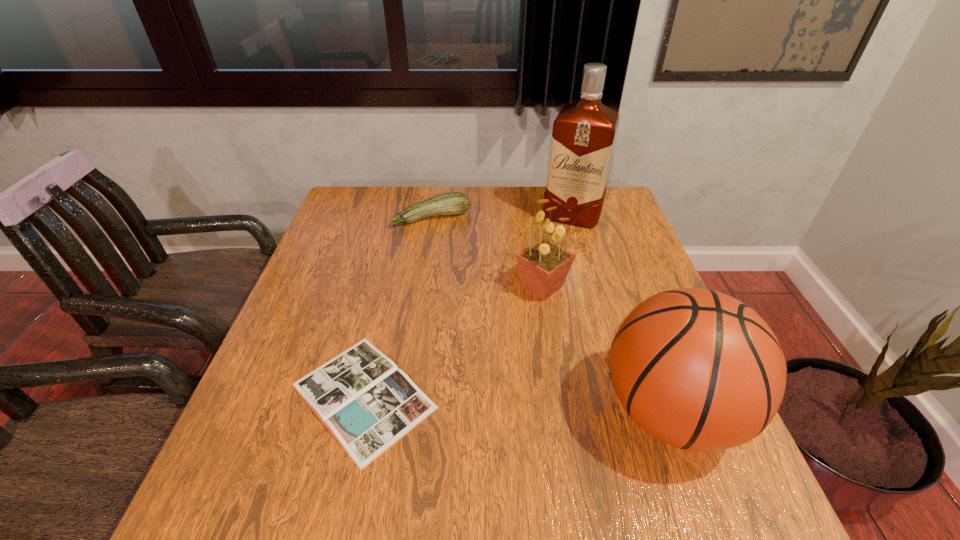
This screenshot has height=540, width=960. In the image, there is a desktop. Identify the location of vacant space at the far left corner. (355, 225).

Locate an element on the screen. vacant space at the near left corner of the desktop is located at coordinates (288, 458).

The image size is (960, 540). What are the coordinates of `free point between the sunflower and the basketball` in the screenshot? It's located at click(x=606, y=350).

What are the coordinates of `unoccupied position between the sunflower and the basketball` in the screenshot? It's located at (606, 350).

Locate an element on the screen. vacant area between the basketball and the book is located at coordinates (516, 404).

I want to click on vacant point located between the third farthest object and the second shortest object, so click(487, 253).

Image resolution: width=960 pixels, height=540 pixels. In order to click on vacant area that lies between the shortest object and the third nearest object in this screenshot , I will do `click(453, 342)`.

Locate an element on the screen. free point between the second shortest object and the book is located at coordinates (397, 307).

What are the coordinates of `free space between the zucchini and the basketball` in the screenshot? It's located at (551, 315).

Identify which object is located as the second nearest to the third nearest object. Please provide its 2D coordinates. Your answer should be formatted as a tuple, i.e. [(x, y)], where the tuple contains the x and y coordinates of a point satisfying the conditions above.

[(583, 137)]